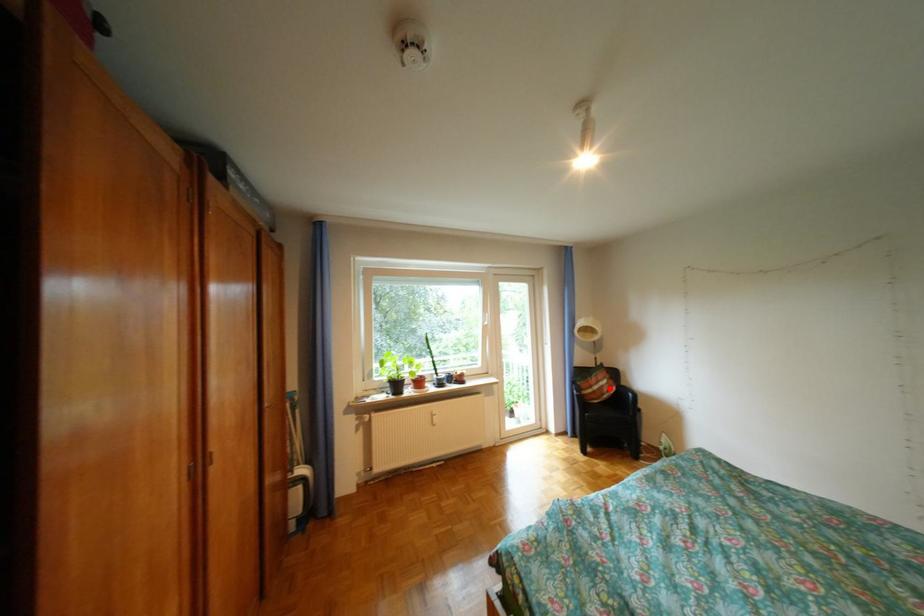
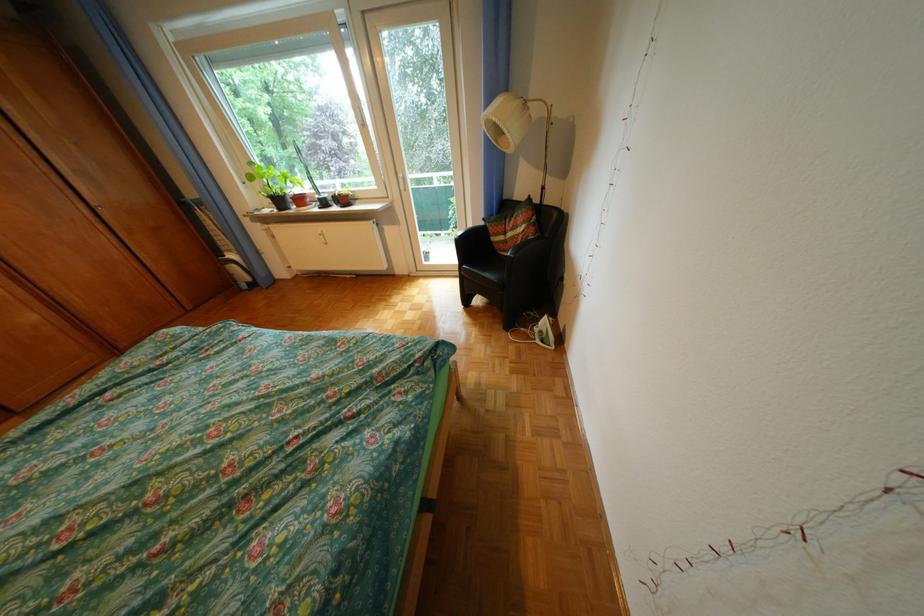
Where in the second image is the point corresponding to the highlighted location from the first image?

(524, 236)